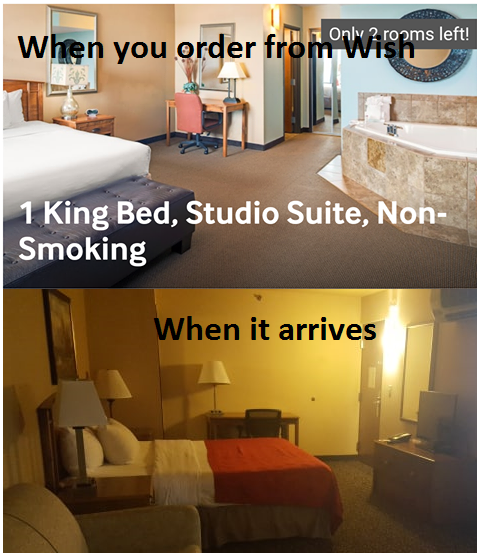
Locate an element on the screen. The image size is (477, 553). mirror is located at coordinates (67, 28).